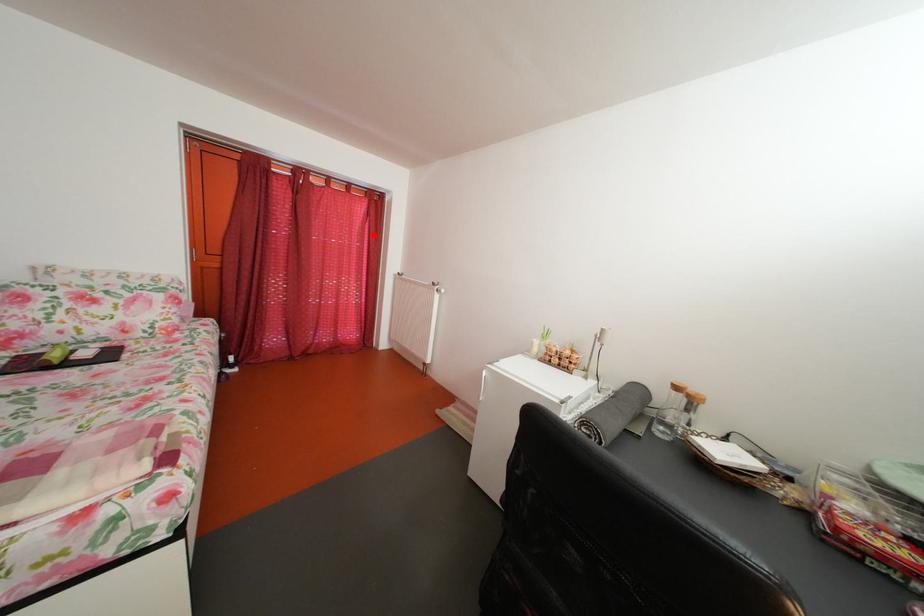
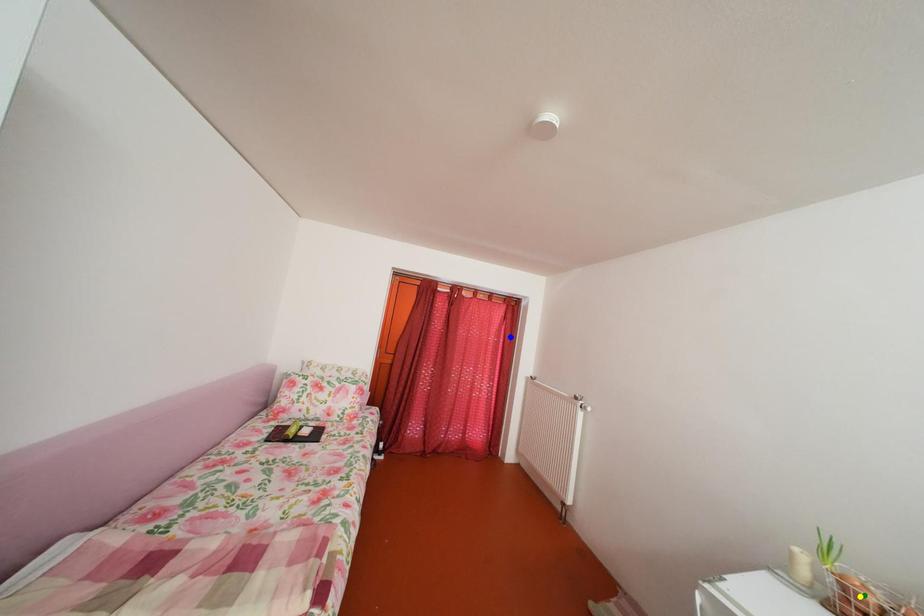
Question: I am providing you with two images of the same scene from different viewpoints. A red point is marked on the first image. You are given multiple points on the second image. Which mark in image 2 goes with the point in image 1?

Choices:
 (A) blue point
 (B) green point
 (C) yellow point

Answer: (A)